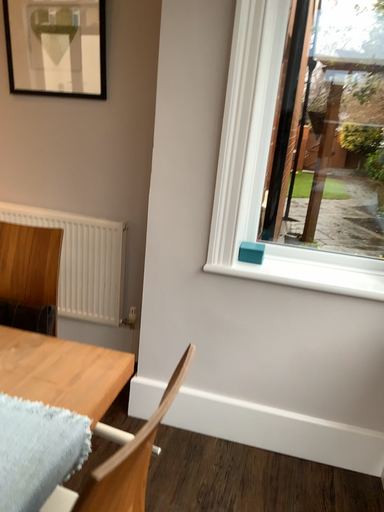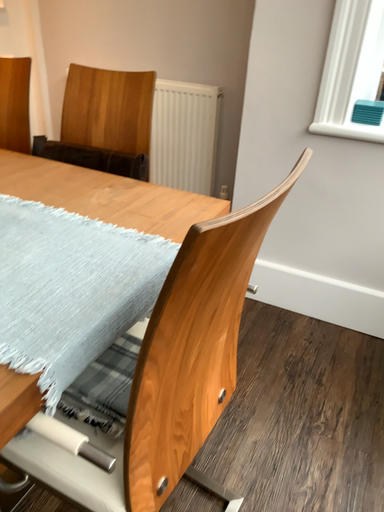
Question: How did the camera likely rotate when shooting the video?

Choices:
 (A) rotated upward
 (B) rotated downward

Answer: (B)